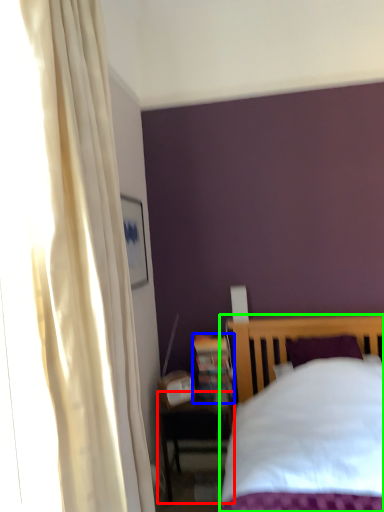
Question: Which object is positioned farthest from nightstand (highlighted by a red box)? Select from bookshelf (highlighted by a blue box) and bed (highlighted by a green box).

Choices:
 (A) bookshelf
 (B) bed

Answer: (B)